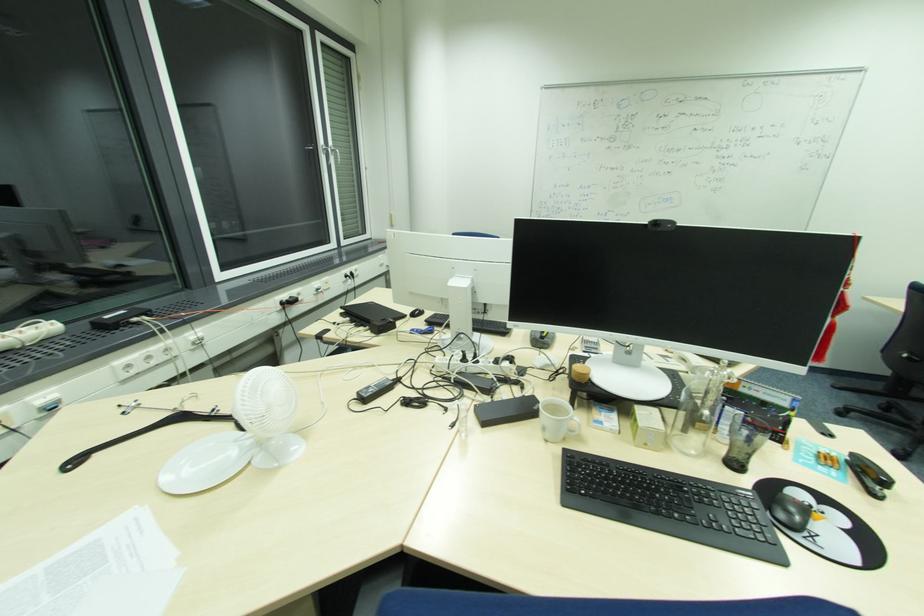
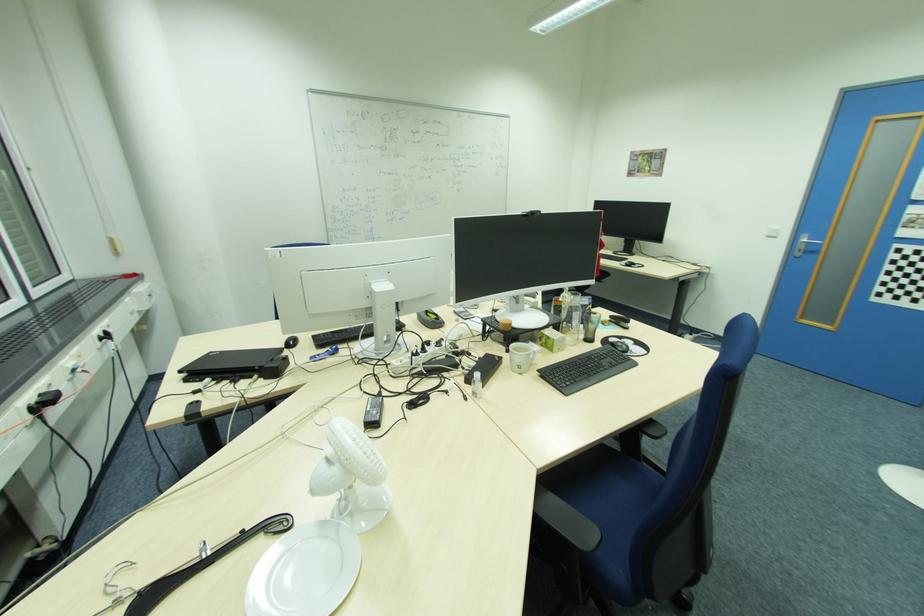
The point at (345, 308) is marked in the first image. Where is the corresponding point in the second image?

(183, 371)